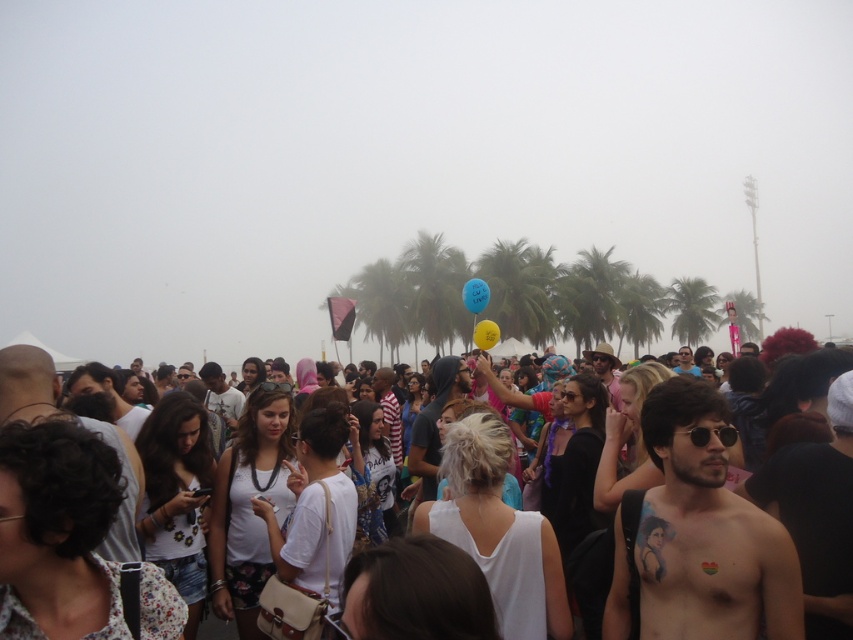
You are a photographer at the festival and want to capture a photo of the yellow rubber balloon at center without the white cotton crowd at center blocking it. Is this possible based on their positions?

The white cotton crowd at center is below the yellow rubber balloon at center, so the balloon is positioned above the crowd. This means the photographer can capture the balloon without obstruction from the crowd by angling the camera upwards or focusing on the higher part of the frame.

You are standing at the point marked as point (805, 381) in the image. What is the nearest object to you in the scene?

The nearest object to you is the white cotton crowd at center, as it is represented by the point (805, 381).